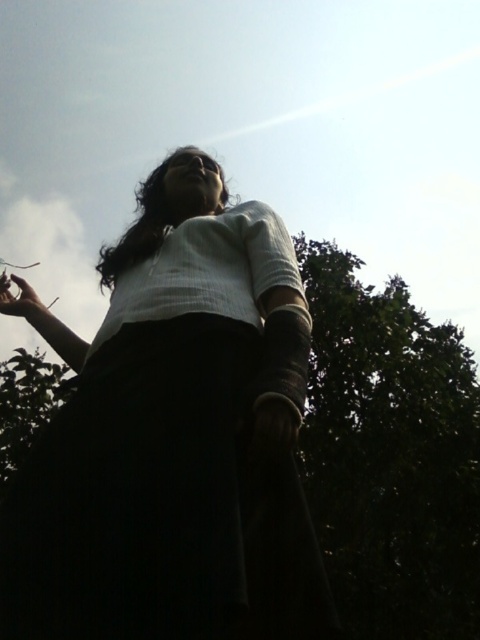
Is white matte shirt at center in front of matte black phone at upper left?

Yes, white matte shirt at center is in front of matte black phone at upper left.

From the picture: Measure the distance between white matte shirt at center and camera.

white matte shirt at center is 1.04 meters away from camera.

You are a GUI agent. You are given a task and a screenshot of the screen. Output one action in this format:
    pyautogui.click(x=<x>, y=<y>)
    Task: Click on the white matte shirt at center
    This screenshot has height=640, width=480.
    Given the screenshot: What is the action you would take?
    pyautogui.click(x=173, y=438)